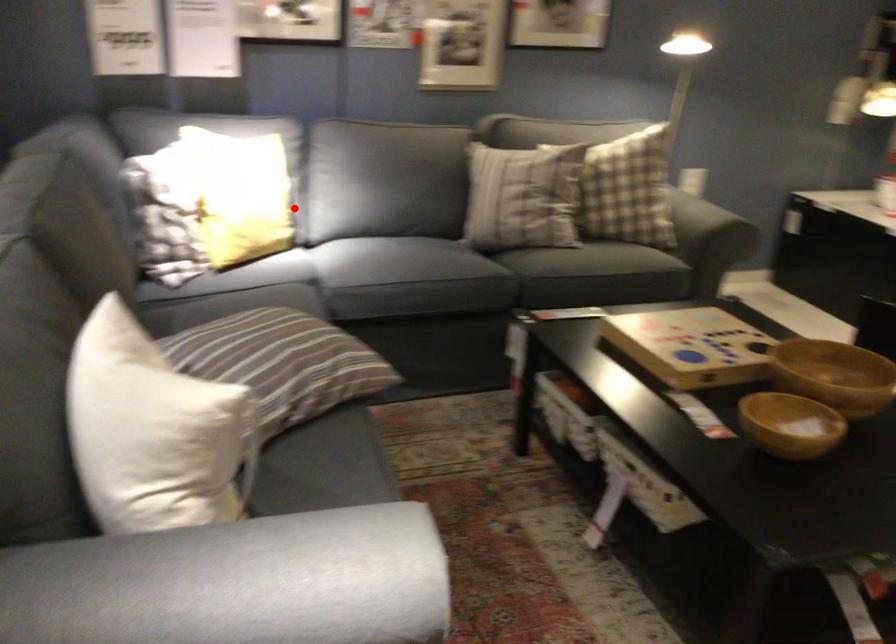
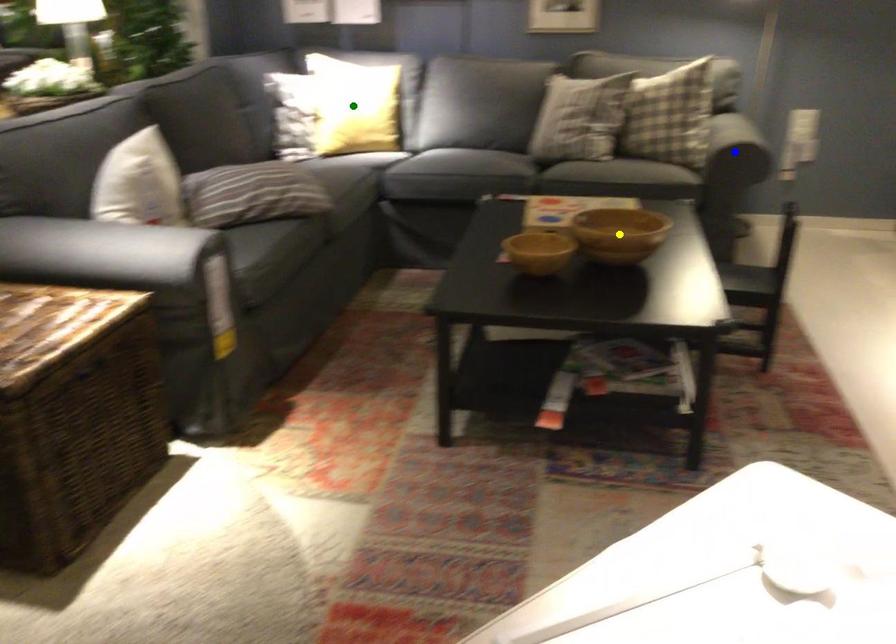
Question: I am providing you with two images of the same scene from different viewpoints. A red point is marked on the first image. You are given multiple points on the second image. Which point in image 2 is actually the same real-world point as the red point in image 1?

Choices:
 (A) green point
 (B) yellow point
 (C) blue point

Answer: (A)